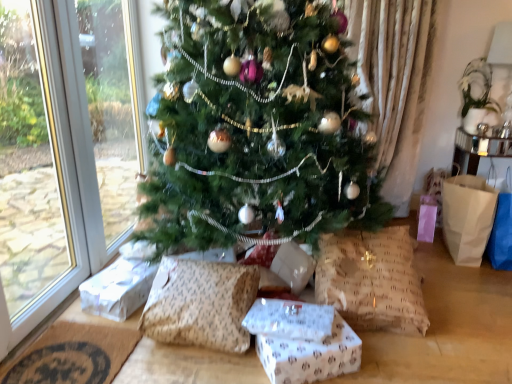
Question: Is the depth of brown textured pillow at lower center, which appears as the second pillow when viewed from the right, less than that of white paper gift at lower left, placed as the second gift box when sorted from front to back?

Choices:
 (A) yes
 (B) no

Answer: (A)

Question: Does brown textured pillow at lower center, marked as the first pillow in a left-to-right arrangement, have a greater height compared to white paper gift at lower left, marked as the second gift box in a right-to-left arrangement?

Choices:
 (A) no
 (B) yes

Answer: (B)

Question: Is brown textured pillow at lower center, marked as the first pillow in a left-to-right arrangement, oriented towards white paper gift at lower left, placed as the second gift box when sorted from front to back?

Choices:
 (A) no
 (B) yes

Answer: (A)

Question: From a real-world perspective, is brown textured pillow at lower center, marked as the first pillow in a left-to-right arrangement, on top of white paper gift at lower left, placed as the second gift box when sorted from front to back?

Choices:
 (A) no
 (B) yes

Answer: (B)

Question: Is brown textured pillow at lower center, marked as the first pillow in a left-to-right arrangement, not near white paper gift at lower left, placed as the second gift box when sorted from front to back?

Choices:
 (A) no
 (B) yes

Answer: (A)

Question: Considering the relative sizes of brown textured pillow at lower center, which appears as the second pillow when viewed from the right, and white paper gift at lower left, marked as the second gift box in a right-to-left arrangement, in the image provided, is brown textured pillow at lower center, which appears as the second pillow when viewed from the right, shorter than white paper gift at lower left, marked as the second gift box in a right-to-left arrangement,?

Choices:
 (A) yes
 (B) no

Answer: (B)

Question: Considering the relative positions of white paper gift at lower left, which is the 1th gift box in back-to-front order, and green matte christmas tree at center in the image provided, is white paper gift at lower left, which is the 1th gift box in back-to-front order, to the left of green matte christmas tree at center from the viewer's perspective?

Choices:
 (A) no
 (B) yes

Answer: (B)

Question: Can you confirm if white paper gift at lower left, which ranks as the first gift box in left-to-right order, is bigger than green matte christmas tree at center?

Choices:
 (A) yes
 (B) no

Answer: (B)

Question: Could green matte christmas tree at center be considered to be inside white paper gift at lower left, placed as the second gift box when sorted from front to back?

Choices:
 (A) yes
 (B) no

Answer: (B)

Question: Is white paper gift at lower left, marked as the second gift box in a right-to-left arrangement, wider than green matte christmas tree at center?

Choices:
 (A) no
 (B) yes

Answer: (A)

Question: Considering the relative positions of white paper gift at lower left, which ranks as the first gift box in left-to-right order, and green matte christmas tree at center in the image provided, is white paper gift at lower left, which ranks as the first gift box in left-to-right order, to the right of green matte christmas tree at center from the viewer's perspective?

Choices:
 (A) no
 (B) yes

Answer: (A)

Question: Does white paper gift at lower left, which is the 1th gift box in back-to-front order, have a lesser width compared to green matte christmas tree at center?

Choices:
 (A) yes
 (B) no

Answer: (A)

Question: Does green matte christmas tree at center have a lesser height compared to brown textured pillow at lower center, marked as the first pillow in a left-to-right arrangement?

Choices:
 (A) yes
 (B) no

Answer: (B)